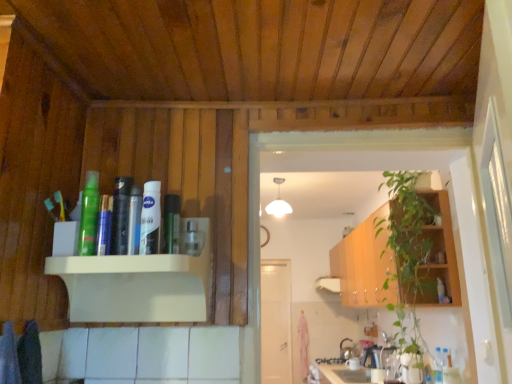
Question: Considering their positions, is white matte door at center located in front of or behind green leafy plant at right?

Choices:
 (A) front
 (B) behind

Answer: (B)

Question: Would you say white matte door at center is to the left or to the right of green leafy plant at right in the picture?

Choices:
 (A) right
 (B) left

Answer: (B)

Question: Based on their relative distances, which object is farther from the green matte bottle at upper center, the 1th toiletry from the right?

Choices:
 (A) white glossy nivea cream at upper center, which ranks as the 2th toiletry in left-to-right order
 (B) green wood cabinet at right
 (C) white matte door at center
 (D) clear plastic bottle at center
 (E) green matte spray can at upper left, acting as the 1th toiletry starting from the left

Answer: (C)

Question: Estimate the real-world distances between objects in this image. Which object is farther from the white glossy nivea cream at upper center, which ranks as the 2th toiletry in left-to-right order?

Choices:
 (A) white matte door at center
 (B) clear plastic bottle at center
 (C) green matte spray can at upper left, acting as the 1th toiletry starting from the left
 (D) green matte bottle at upper center, the 1th toiletry from the right
 (E) green wood cabinet at right

Answer: (A)